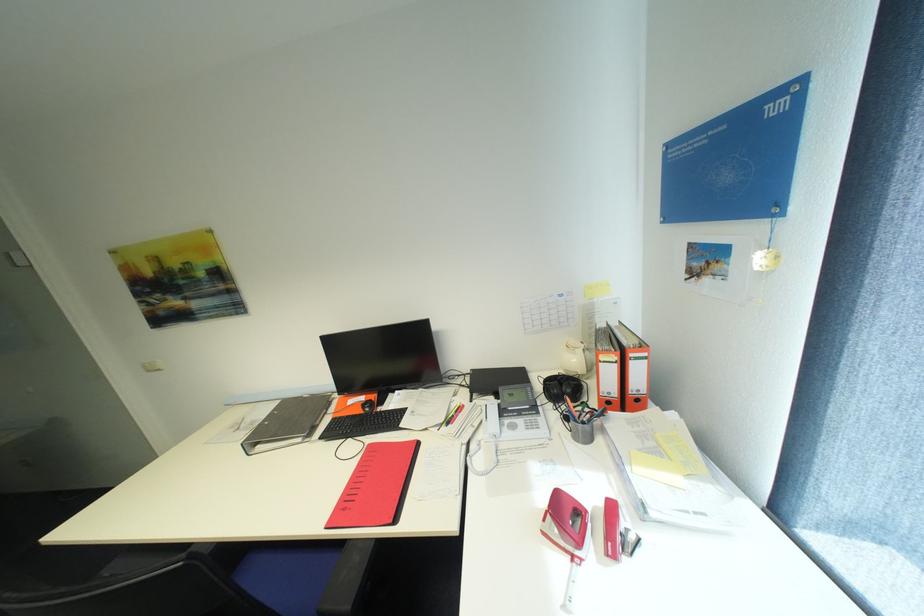
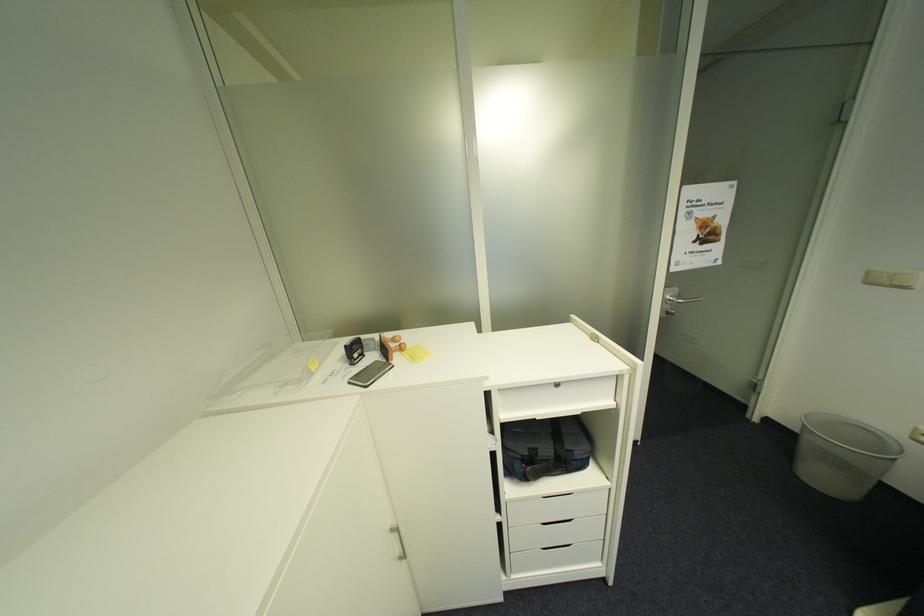
Locate, in the second image, the point that corresponds to pixel 157 371 in the first image.

(876, 284)